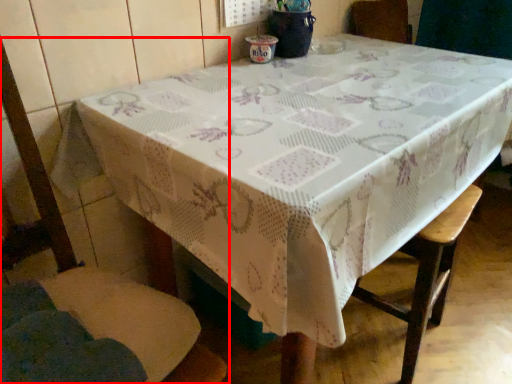
Question: From the image's perspective, considering the relative positions of chair (annotated by the red box) and bar stool in the image provided, where is chair (annotated by the red box) located with respect to the staircase?

Choices:
 (A) below
 (B) above

Answer: (B)